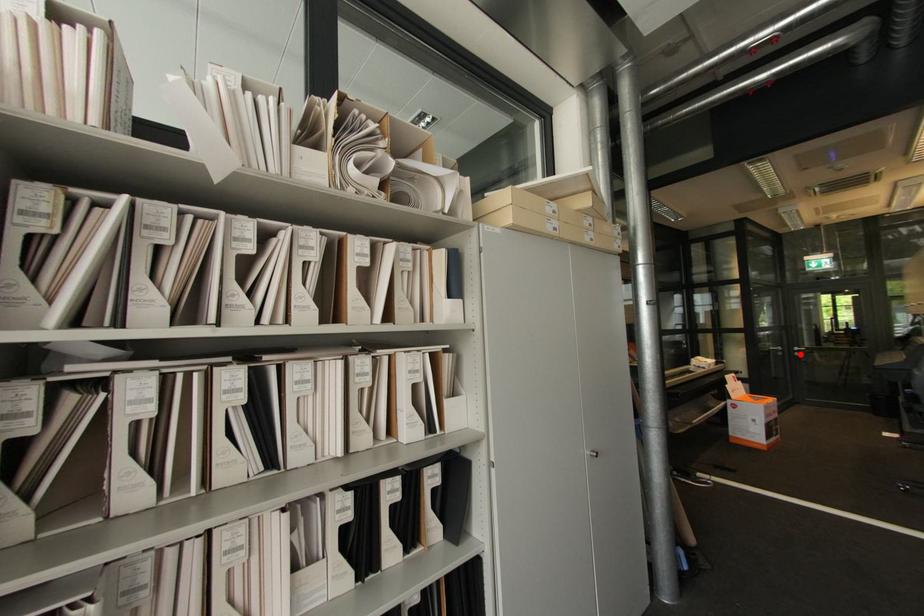
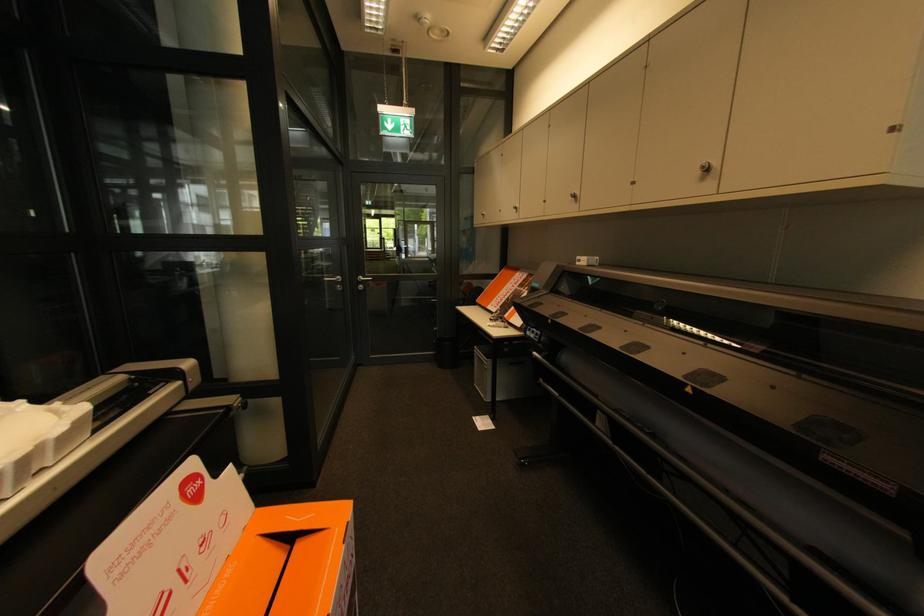
Question: I am providing you with two images of the same scene from different viewpoints. Given a red point in image1, look at the same physical point in image2. Is it:

Choices:
 (A) Closer to the viewpoint
 (B) Farther from the viewpoint

Answer: (B)